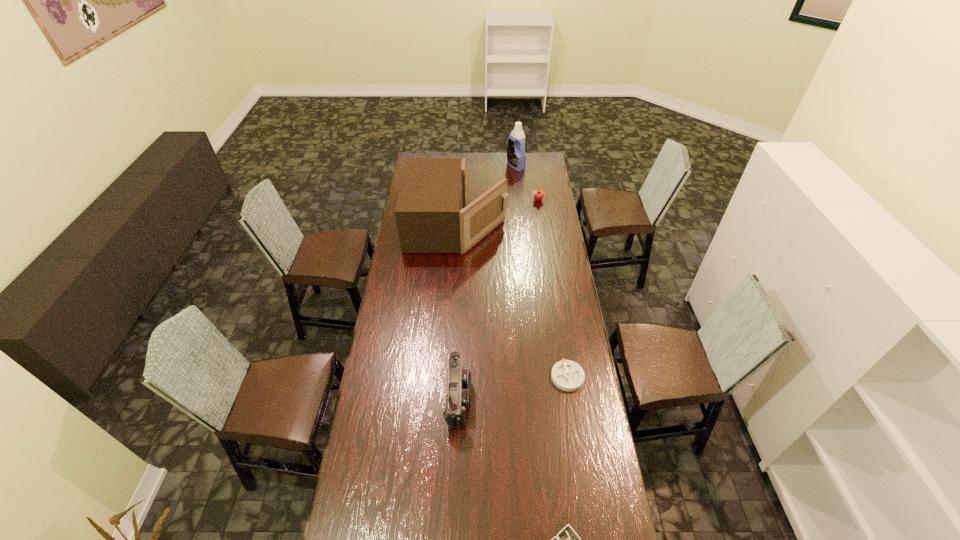
Locate an element on the screen. empty space that is in between the apple and the detergent is located at coordinates (527, 183).

Locate an element on the screen. Image resolution: width=960 pixels, height=540 pixels. vacant area that lies between the farther ashtray and the microwave oven is located at coordinates (513, 301).

The height and width of the screenshot is (540, 960). Identify the location of free space between the fourth tallest object and the farther ashtray. (553, 288).

The height and width of the screenshot is (540, 960). I want to click on vacant space that's between the camcorder and the microwave oven, so click(x=458, y=312).

Find the location of a particular element. This screenshot has width=960, height=540. blank region between the camcorder and the farther ashtray is located at coordinates (513, 387).

At what (x,y) coordinates should I click in order to perform the action: click on unoccupied position between the camcorder and the detergent. Please return your answer as a coordinate pair (x, y). The image size is (960, 540). Looking at the image, I should click on (487, 281).

Find the location of a particular element. object that is the fifth closest to the farther ashtray is located at coordinates (516, 158).

Identify which object is the fifth closest to the third tallest object. Please provide its 2D coordinates. Your answer should be formatted as a tuple, i.e. [(x, y)], where the tuple contains the x and y coordinates of a point satisfying the conditions above.

[(516, 158)]

Locate an element on the screen. The width and height of the screenshot is (960, 540). vacant area in the image that satisfies the following two spatial constraints: 1. on the front side of the farther ashtray; 2. on the front-facing side of the third tallest object is located at coordinates (570, 397).